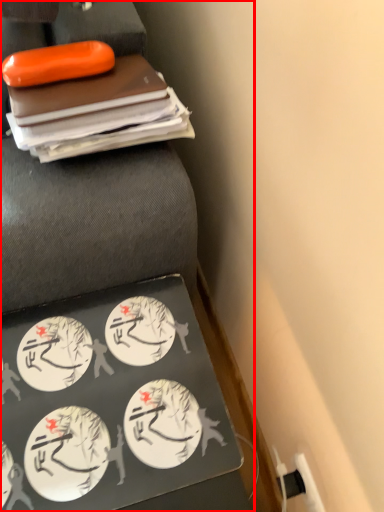
Question: From the image's perspective, where is furniture (annotated by the red box) located relative to food?

Choices:
 (A) above
 (B) below

Answer: (A)